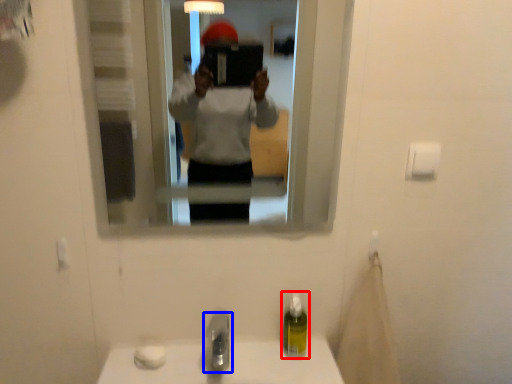
Question: Which point is further to the camera, soap dispenser (highlighted by a red box) or tap (highlighted by a blue box)?

Choices:
 (A) soap dispenser
 (B) tap

Answer: (A)